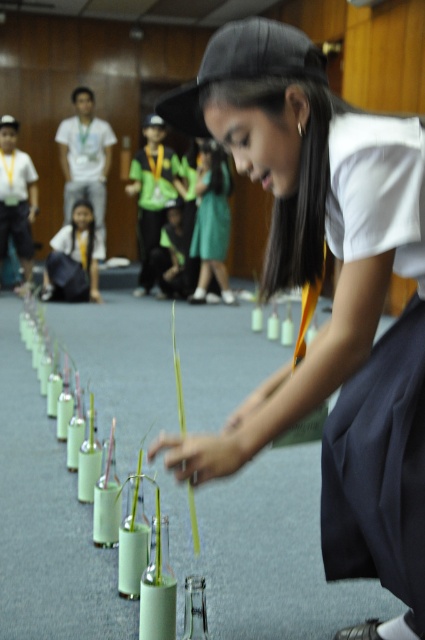
Looking at this image, you are a photographer trying to capture a closeup of the white matte uniform at center and the matte black backpack at center. Since you want to focus on the uniform, which object should you move closer to the camera to ensure the uniform is in focus?

The white matte uniform at center is bigger than the matte black backpack at center, so to focus on the uniform, you should move the white matte uniform at center closer to the camera.

Based on the photo, what is located at the point with coordinates (212, 221) in the image?

The point with coordinates (212, 221) is located on the green fabric dress at center.